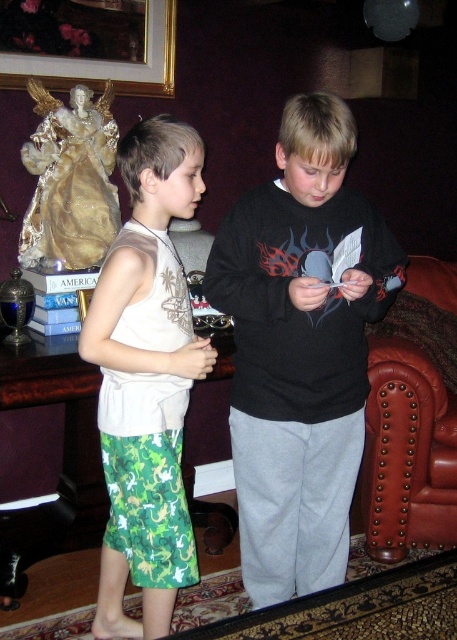
Does leather studded armchair at right appear on the right side of goldmetallicpicture frame at upper left?

Indeed, leather studded armchair at right is positioned on the right side of goldmetallicpicture frame at upper left.

Is leather studded armchair at right taller than goldmetallicpicture frame at upper left?

Indeed, leather studded armchair at right has a greater height compared to goldmetallicpicture frame at upper left.

Does point (410, 531) lie in front of point (93, 64)?

Yes, point (410, 531) is closer to viewer.

You are a GUI agent. You are given a task and a screenshot of the screen. Output one action in this format:
    pyautogui.click(x=<x>, y=<y>)
    Task: Click on the leather studded armchair at right
    This screenshot has width=457, height=640.
    Given the screenshot: What is the action you would take?
    pyautogui.click(x=407, y=452)

Can you confirm if green printed shorts at left is positioned to the left of leather studded armchair at right?

Correct, you'll find green printed shorts at left to the left of leather studded armchair at right.

Consider the image. Does green printed shorts at left lie behind leather studded armchair at right?

No, it is in front of leather studded armchair at right.

Is point (166, 115) less distant than point (436, 384)?

Yes, it is.

Find the location of a particular element. Image resolution: width=457 pixels, height=640 pixels. green printed shorts at left is located at coordinates (147, 380).

Does black matte sweatshirt at center have a larger size compared to leather studded armchair at right?

Correct, black matte sweatshirt at center is larger in size than leather studded armchair at right.

Which of these two, black matte sweatshirt at center or leather studded armchair at right, stands shorter?

leather studded armchair at right is shorter.

Is point (306, 428) behind point (386, 481)?

That is False.

This screenshot has width=457, height=640. In order to click on black matte sweatshirt at center in this screenshot , I will do `click(299, 349)`.